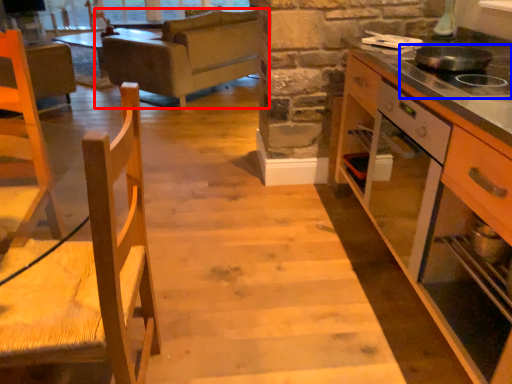
Question: Which point is further to the camera, studio couch (highlighted by a red box) or gas stove (highlighted by a blue box)?

Choices:
 (A) studio couch
 (B) gas stove

Answer: (A)